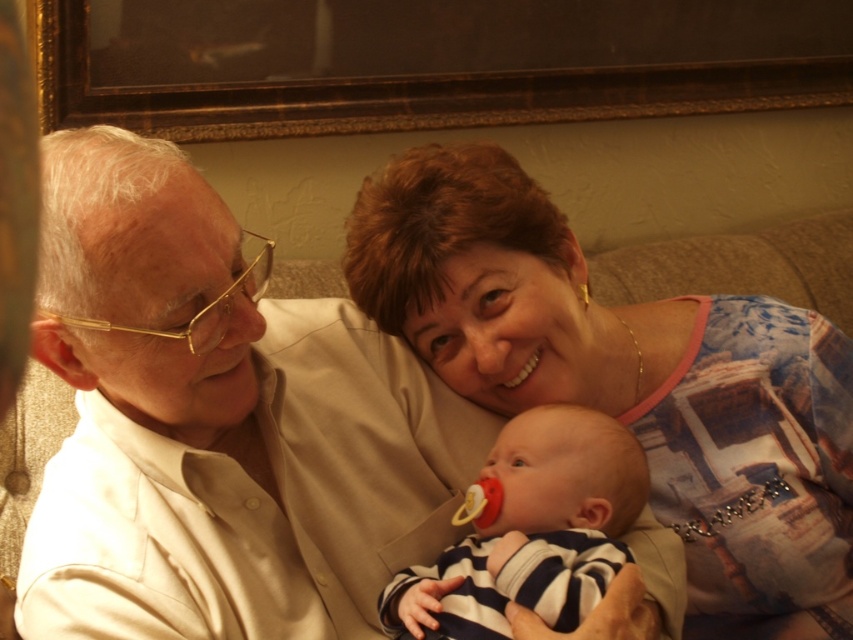
Question: Is matte beige blouse at upper right above dark brown wooden picture frame at upper center?

Choices:
 (A) yes
 (B) no

Answer: (B)

Question: Estimate the real-world distances between objects in this image. Which object is closer to the striped fabric baby at center?

Choices:
 (A) matte beige blouse at upper right
 (B) dark brown wooden picture frame at upper center

Answer: (A)

Question: Which point is closer to the camera taking this photo?

Choices:
 (A) (239, 29)
 (B) (483, 627)

Answer: (B)

Question: Can you confirm if matte beige blouse at upper right is bigger than striped fabric baby at center?

Choices:
 (A) yes
 (B) no

Answer: (A)

Question: Which object is farther from the camera taking this photo?

Choices:
 (A) dark brown wooden picture frame at upper center
 (B) matte beige blouse at upper right

Answer: (A)

Question: Is matte beige blouse at upper right positioned behind striped fabric baby at center?

Choices:
 (A) no
 (B) yes

Answer: (B)